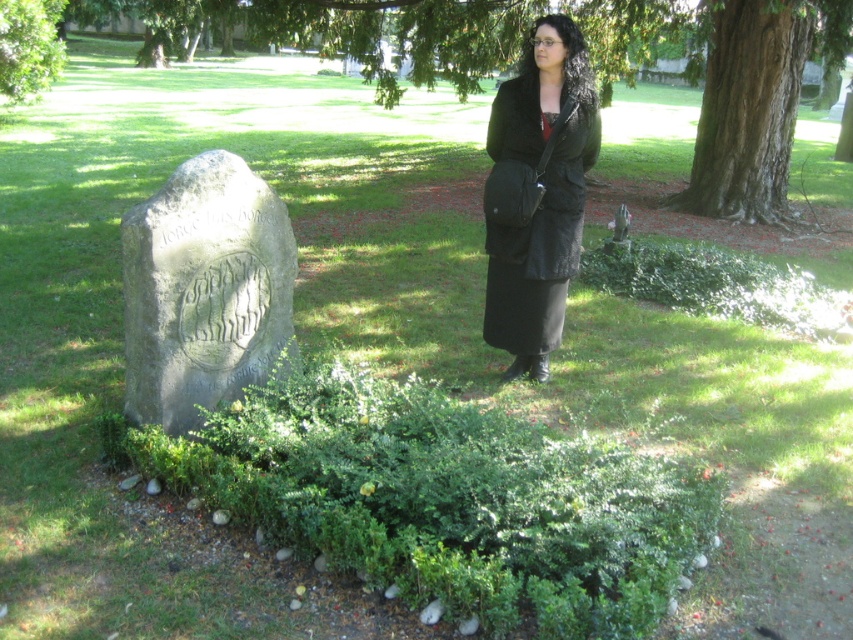
You are a hiker trying to navigate through the park. You see a smooth brown bark at upper right and a green leafy tree at upper left. Which object is positioned lower in the scene?

The smooth brown bark at upper right is located below the green leafy tree at upper left, so it is positioned lower in the scene.